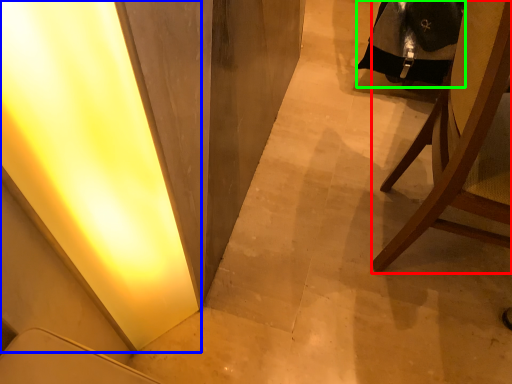
Question: Estimate the real-world distances between objects in this image. Which object is closer to chair (highlighted by a red box), light (highlighted by a blue box) or robe (highlighted by a green box)?

Choices:
 (A) light
 (B) robe

Answer: (B)